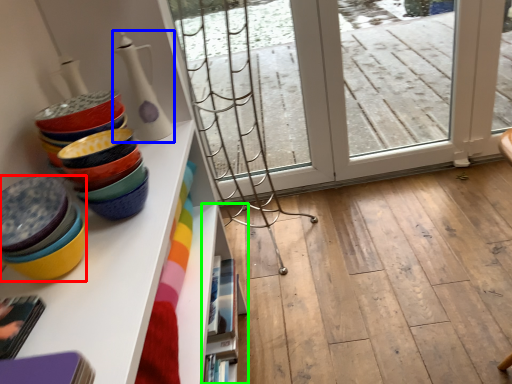
Question: Which object is the farthest from table (highlighted by a red box)? Choose among these: tableware (highlighted by a blue box) or shelf (highlighted by a green box).

Choices:
 (A) tableware
 (B) shelf

Answer: (B)